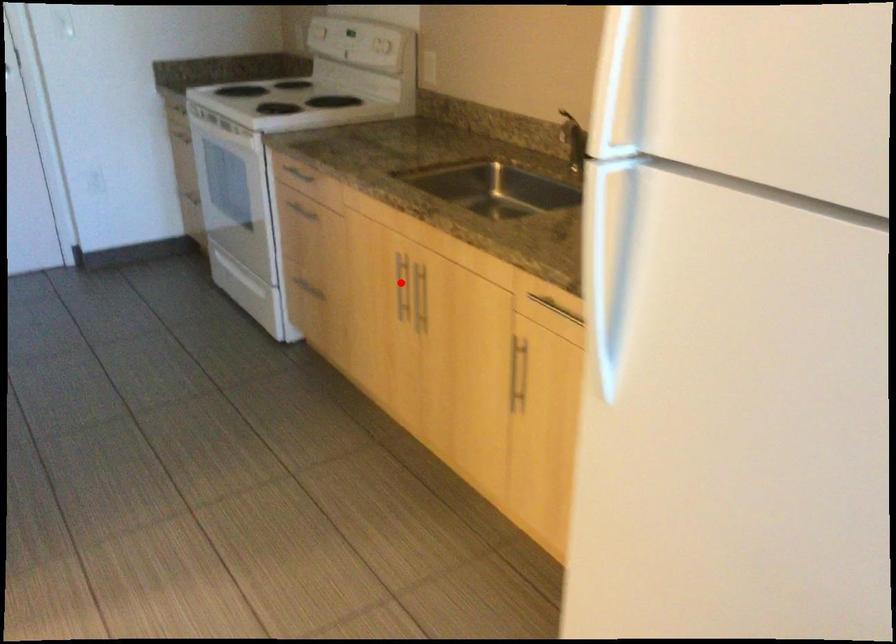
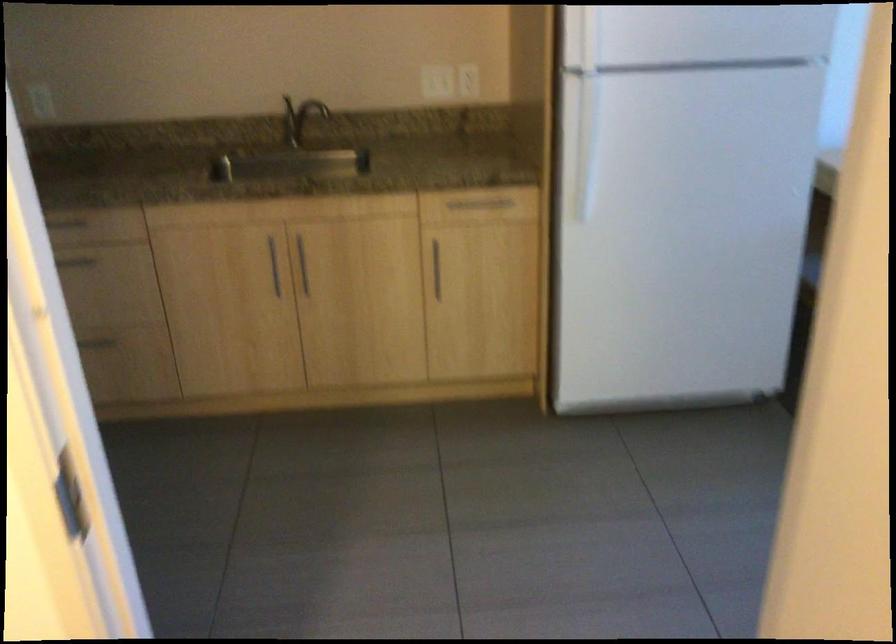
In the second image, find the point that corresponds to the highlighted location in the first image.

(273, 265)